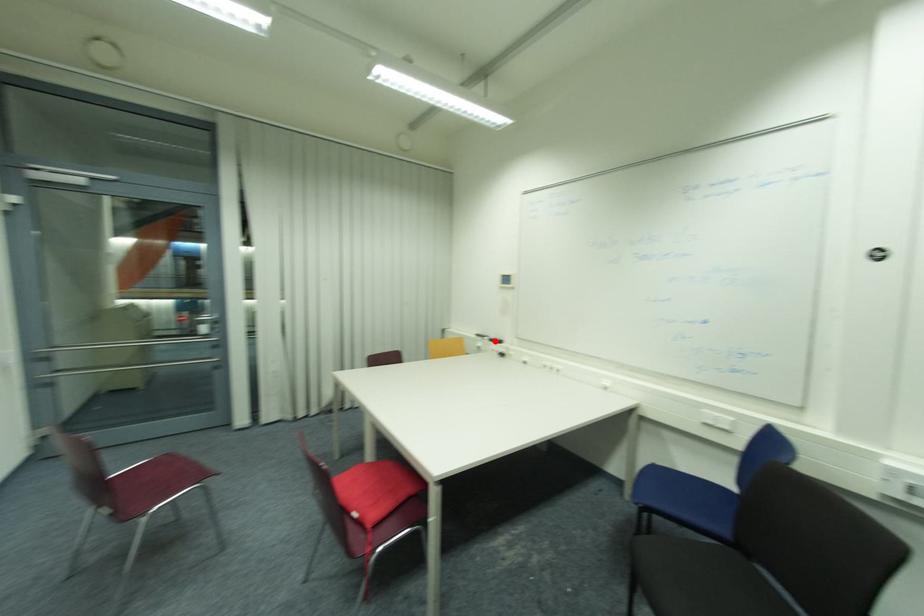
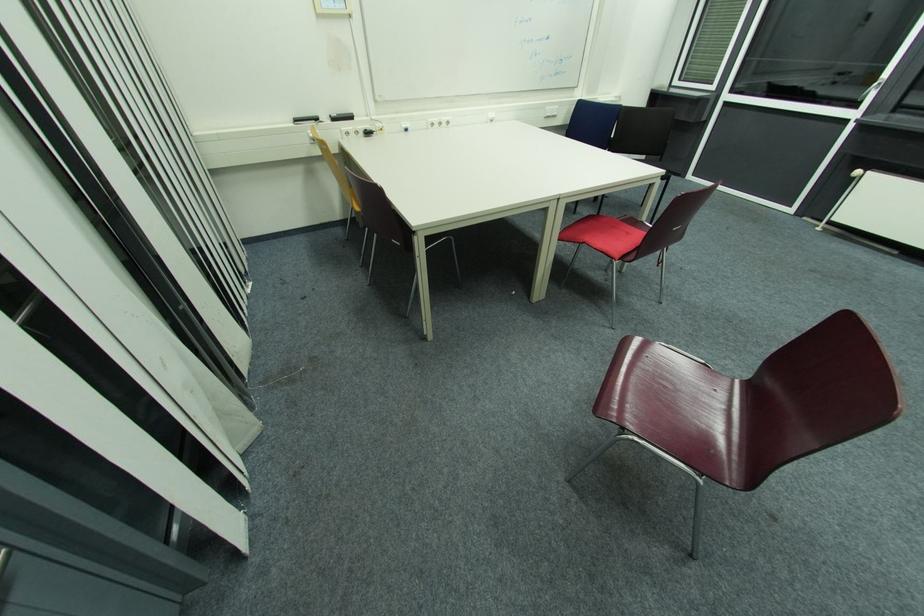
Locate, in the second image, the point that corresponds to the highlighted location in the first image.

(337, 121)